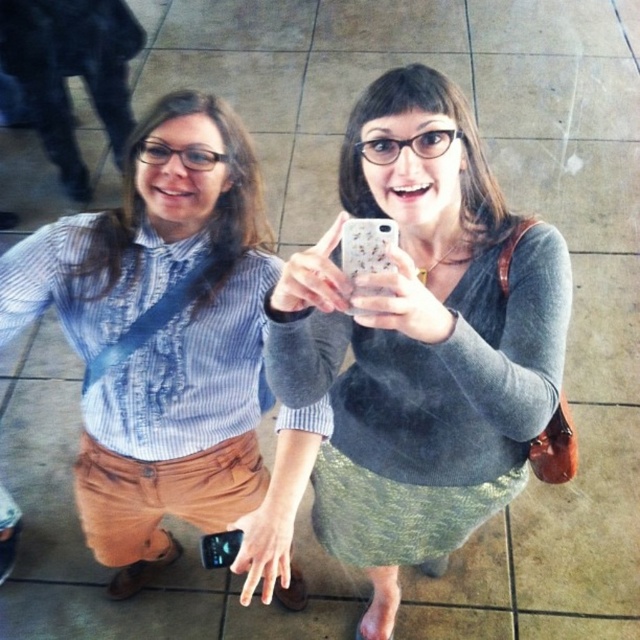
In the scene shown: Is gray wool sweater at center to the left of blue striped shirt at center from the viewer's perspective?

Incorrect, gray wool sweater at center is not on the left side of blue striped shirt at center.

Is point (314, 323) closer to camera compared to point (160, 109)?

Yes, point (314, 323) is in front of point (160, 109).

Measure the distance between gray wool sweater at center and camera.

35.91 inches

Locate an element on the screen. The image size is (640, 640). gray wool sweater at center is located at coordinates (420, 340).